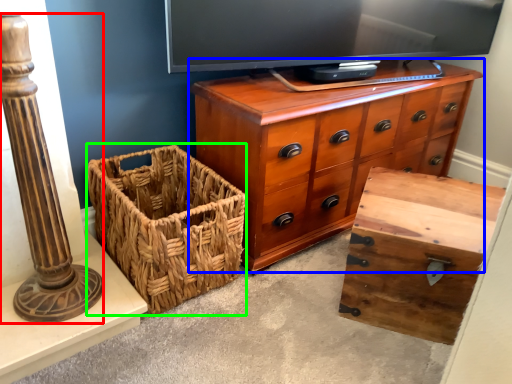
Question: Based on their relative distances, which object is farther from pillar (highlighted by a red box)? Choose from chest of drawers (highlighted by a blue box) and basket (highlighted by a green box).

Choices:
 (A) chest of drawers
 (B) basket

Answer: (A)